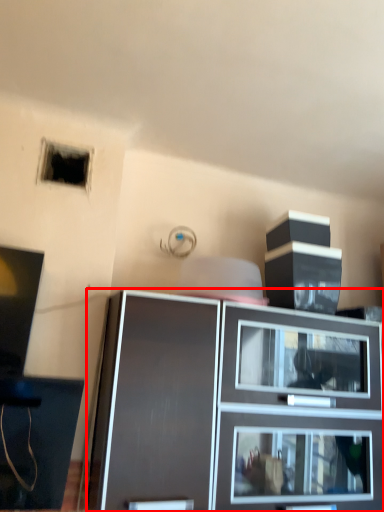
Question: From the image's perspective, where is cabinetry (annotated by the red box) located relative to hole?

Choices:
 (A) below
 (B) above

Answer: (A)